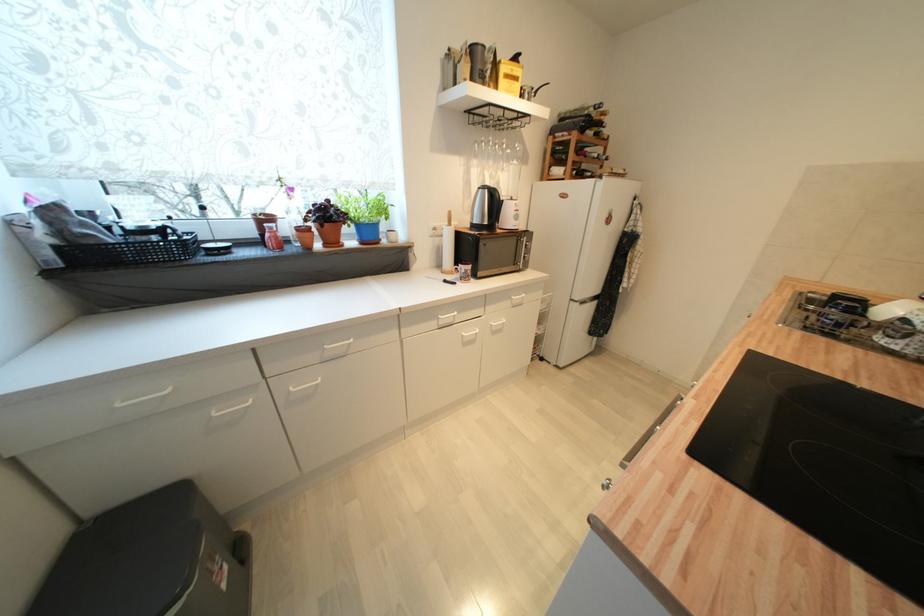
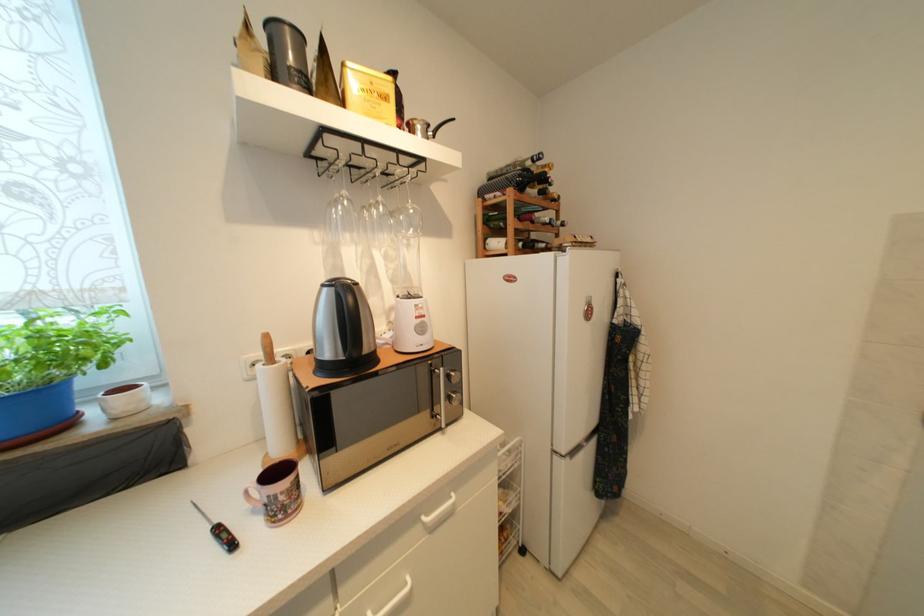
The point at (594, 135) is marked in the first image. Where is the corresponding point in the second image?

(538, 193)